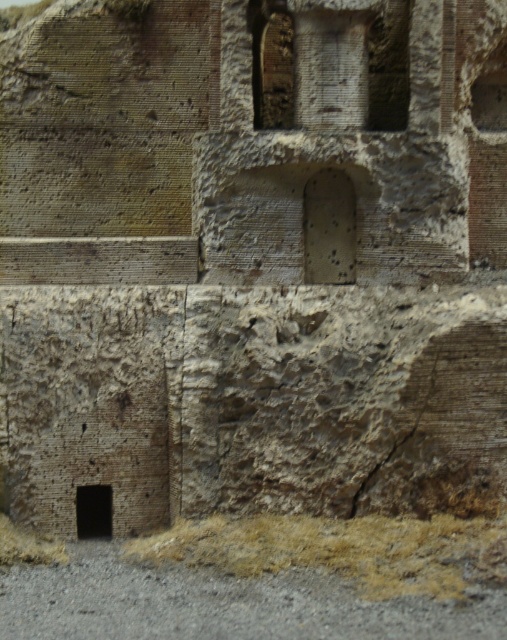
You are an archaeologist examining the ancient ruins. You notice brown dry grass at lower center and black stone hole at lower left. Which object is positioned lower in the scene?

The brown dry grass at lower center is located below the black stone hole at lower left, so it is positioned lower in the scene.

You are standing in front of the ancient ruins and see a point marked at coordinates (341, 548). Based on the scene description, where exactly is this point located?

The point is on brown dry grass at lower center.

In the scene shown: You are a photographer standing at the center of the ancient ruins. You want to take a photo that includes both the point at coordinates point (213, 560) and point (98, 524). Which point should you focus on first to ensure both are in sharp focus?

You should focus on point (98, 524) first because it is farther from the camera than point (213, 560). By focusing on the farther point, the closer point will also be within the depth of field, ensuring both are in sharp focus.